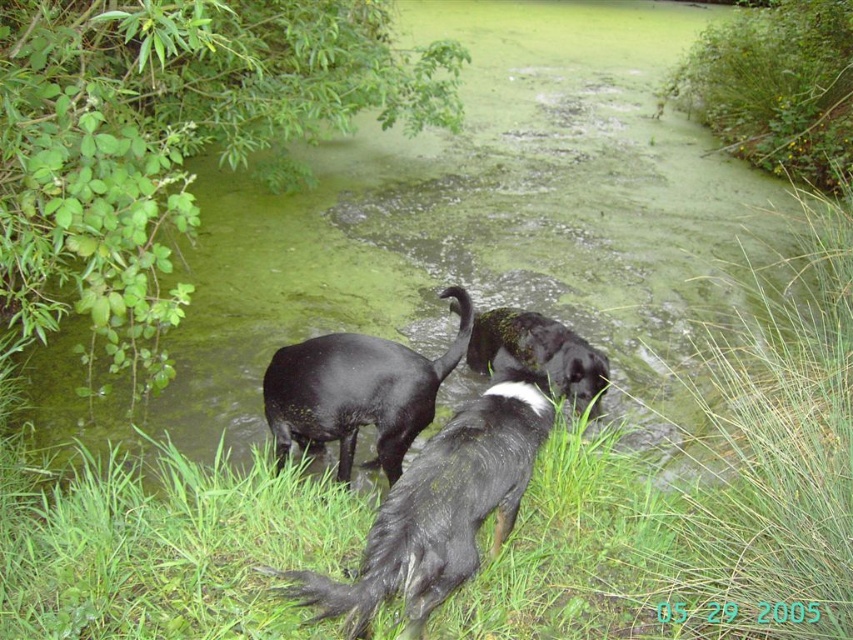
Question: Considering the relative positions of black matte dog at center and shiny black dog at center in the image provided, where is black matte dog at center located with respect to shiny black dog at center?

Choices:
 (A) above
 (B) below

Answer: (B)

Question: Can you confirm if black fur dog at center is positioned to the left of black matte dog at center?

Choices:
 (A) no
 (B) yes

Answer: (A)

Question: Which is nearer to the black matte dog at center?

Choices:
 (A) black fur dog at center
 (B) shiny black dog at center

Answer: (A)

Question: Which object appears farthest from the camera in this image?

Choices:
 (A) shiny black dog at center
 (B) black matte dog at center
 (C) black fur dog at center

Answer: (A)

Question: Which point is farther to the camera?

Choices:
 (A) shiny black dog at center
 (B) black fur dog at center

Answer: (A)

Question: Can you confirm if black fur dog at center is thinner than shiny black dog at center?

Choices:
 (A) yes
 (B) no

Answer: (B)